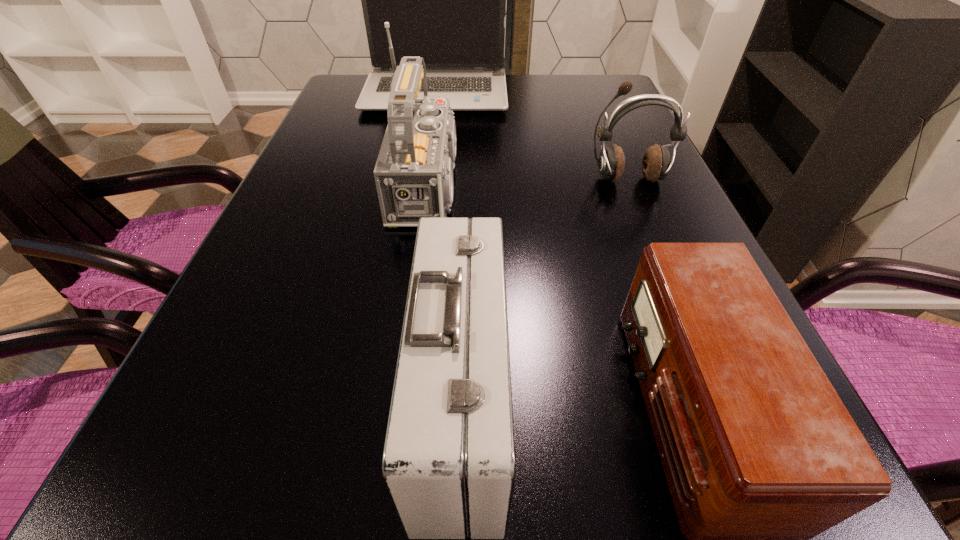
The width and height of the screenshot is (960, 540). I want to click on object at the far left corner, so click(445, 0).

Locate an element on the screen. Image resolution: width=960 pixels, height=540 pixels. vacant region at the near edge of the desktop is located at coordinates (580, 516).

This screenshot has height=540, width=960. Identify the location of vacant space at the left edge of the desktop. (300, 192).

Where is `vacant space at the right edge of the desktop`? This screenshot has width=960, height=540. vacant space at the right edge of the desktop is located at coordinates (658, 229).

The width and height of the screenshot is (960, 540). I want to click on vacant area at the near left corner, so click(x=117, y=526).

At what (x,y) coordinates should I click in order to perform the action: click on vacant region at the far right corner. Please return your answer as a coordinate pair (x, y). This screenshot has width=960, height=540. Looking at the image, I should click on (600, 97).

The height and width of the screenshot is (540, 960). Find the location of `vacant area between the farther radio receiver and the earphone`. vacant area between the farther radio receiver and the earphone is located at coordinates (531, 183).

I want to click on the third closest object relative to the right radio receiver, so click(656, 163).

Identify the location of object that is the fourth nearest to the farthest object. The height and width of the screenshot is (540, 960). (760, 454).